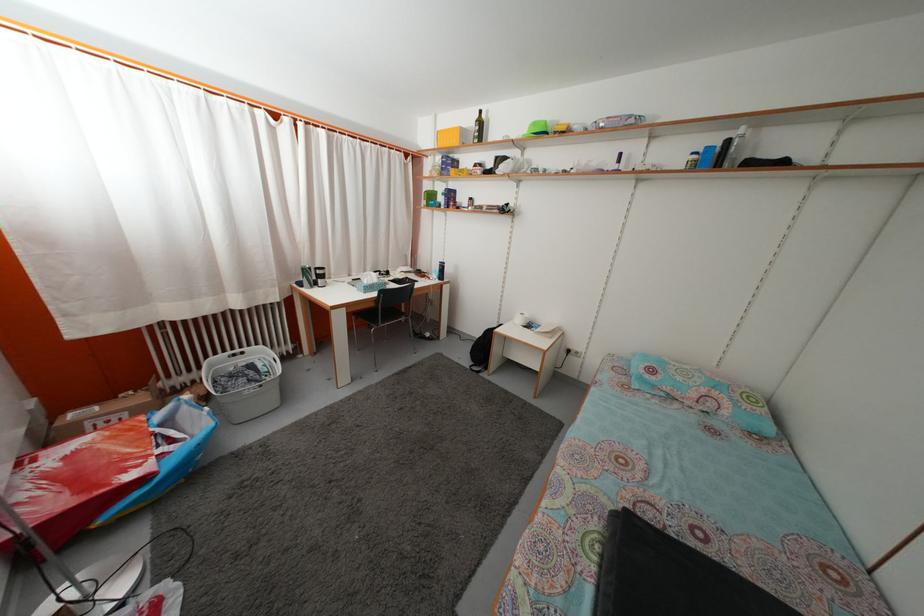
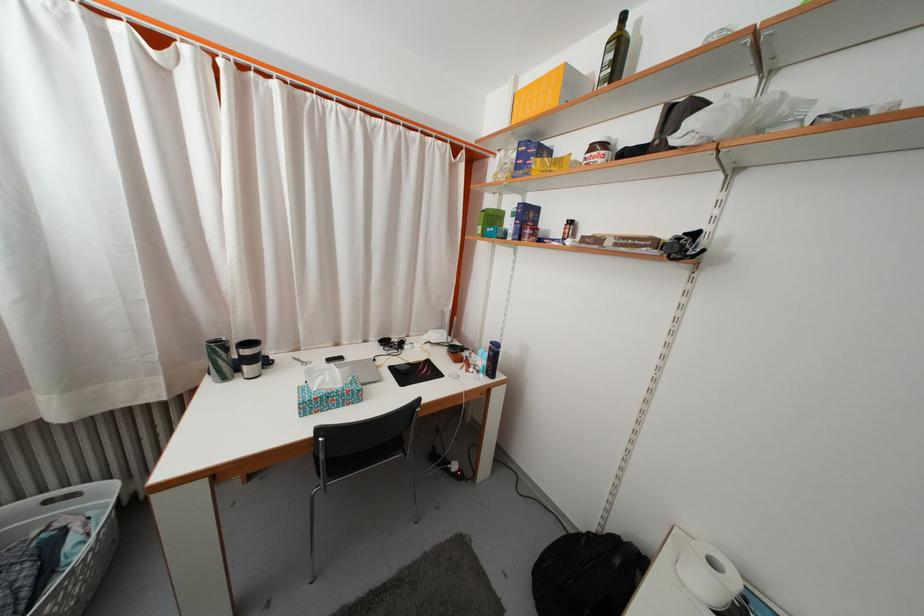
In the second image, find the point that corresponds to pixel 231 359 in the first image.

(49, 498)